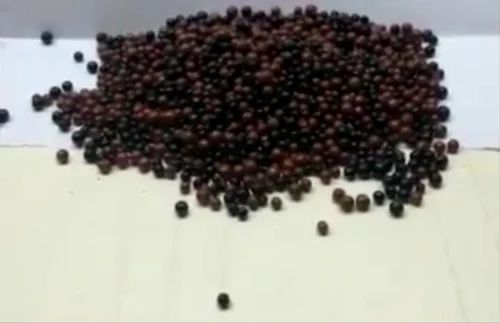
Locate an element on the screen. light grey area of table is located at coordinates (15, 86), (476, 75).